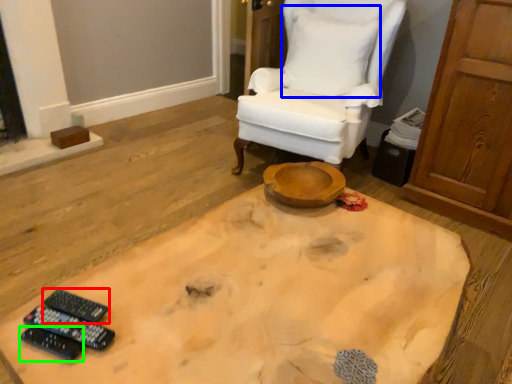
Question: Based on their relative distances, which object is nearer to remote control (highlighted by a red box)? Choose from pillow (highlighted by a blue box) and remote control (highlighted by a green box).

Choices:
 (A) pillow
 (B) remote control

Answer: (B)